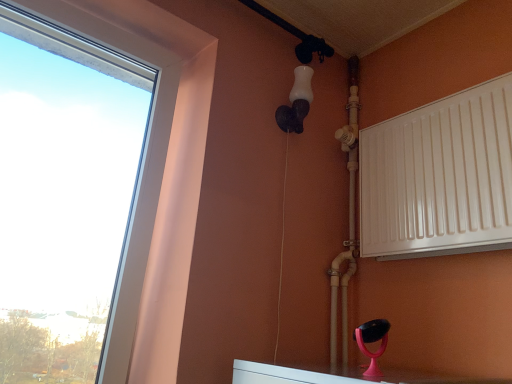
This screenshot has height=384, width=512. I want to click on white matte radiator at right, so click(439, 177).

Describe the element at coordinates (349, 219) in the screenshot. I see `white glossy pipe at upper right` at that location.

Find the location of a particular element. The image size is (512, 384). white plastic window at left is located at coordinates (146, 184).

Is white plastic window at left smaller than white matte light fixture at upper center?

No.

Does white plastic window at left have a lesser width compared to white matte light fixture at upper center?

Incorrect, the width of white plastic window at left is not less than that of white matte light fixture at upper center.

From the image's perspective, is white plastic window at left on top of white matte light fixture at upper center?

No, from the image's perspective, white plastic window at left is not on top of white matte light fixture at upper center.

Is white glossy pipe at upper right smaller than white matte light fixture at upper center?

No, white glossy pipe at upper right is not smaller than white matte light fixture at upper center.

Is white glossy pipe at upper right not near white matte light fixture at upper center?

No, white glossy pipe at upper right is not far from white matte light fixture at upper center.

Does white glossy pipe at upper right turn towards white matte light fixture at upper center?

Yes.

Is white matte light fixture at upper center surrounded by white glossy pipe at upper right?

Definitely not — white matte light fixture at upper center is not inside white glossy pipe at upper right.

This screenshot has height=384, width=512. What are the coordinates of `pipe on the right side of white plastic window at left` in the screenshot? It's located at (349, 219).

Which is more to the right, white plastic window at left or white glossy pipe at upper right?

From the viewer's perspective, white glossy pipe at upper right appears more on the right side.

Is white plastic window at left inside the boundaries of white glossy pipe at upper right, or outside?

white plastic window at left is not inside white glossy pipe at upper right, it's outside.

Is white glossy pipe at upper right in front of or behind white matte radiator at right in the image?

Clearly, white glossy pipe at upper right is behind white matte radiator at right.

Between white glossy pipe at upper right and white matte radiator at right, which one has less height?

With less height is white matte radiator at right.

Does white glossy pipe at upper right have a smaller size compared to white matte radiator at right?

Correct, white glossy pipe at upper right occupies less space than white matte radiator at right.

Considering the relative sizes of white glossy pipe at upper right and white matte radiator at right in the image provided, is white glossy pipe at upper right wider than white matte radiator at right?

Yes, white glossy pipe at upper right is wider than white matte radiator at right.

From a real-world perspective, who is located lower, white glossy pipe at upper right or white plastic window at left?

Answer: From a 3D spatial view, white plastic window at left is below.

Would you say white glossy pipe at upper right is inside or outside white plastic window at left?

white glossy pipe at upper right exists outside the volume of white plastic window at left.

Can you confirm if white glossy pipe at upper right is smaller than white plastic window at left?

Yes, white glossy pipe at upper right is smaller than white plastic window at left.

Which is farther from the camera, (397, 128) or (180, 60)?

Point (180, 60)

Which object is further away from the camera, white matte radiator at right or white plastic window at left?

white matte radiator at right is behind.

From a real-world perspective, is white matte radiator at right positioned above or below white plastic window at left?

white matte radiator at right is situated higher than white plastic window at left in the real world.

Are white matte radiator at right and white plastic window at left located far from each other?

white matte radiator at right is near white plastic window at left, not far away.

Is white plastic window at left not within white matte radiator at right?

Yes, white plastic window at left is not within white matte radiator at right.

Measure the distance between white plastic window at left and white matte radiator at right.

They are 31.21 inches apart.

Looking at this image, visually, is white plastic window at left positioned to the left or to the right of white matte radiator at right?

white plastic window at left is positioned on white matte radiator at right's left side.

From the image's perspective, is white plastic window at left on top of white matte radiator at right?

Correct, white plastic window at left appears higher than white matte radiator at right in the image.

At what (x,y) coordinates should I click in order to perform the action: click on window below the white matte light fixture at upper center (from the image's perspective). Please return your answer as a coordinate pair (x, y). The width and height of the screenshot is (512, 384). Looking at the image, I should click on (146, 184).

Find the location of `pipe below the white matte light fixture at upper center (from a real-world perspective)`. pipe below the white matte light fixture at upper center (from a real-world perspective) is located at coordinates (349, 219).

Considering their positions, is white matte light fixture at upper center positioned further to white matte radiator at right than white plastic window at left?

Among the two, white plastic window at left is located further to white matte radiator at right.

When comparing their distances from white glossy pipe at upper right, does white plastic window at left or white matte light fixture at upper center seem closer?

Based on the image, white matte light fixture at upper center appears to be nearer to white glossy pipe at upper right.

Looking at the image, which one is located further to white matte light fixture at upper center, white plastic window at left or white glossy pipe at upper right?

white plastic window at left is further to white matte light fixture at upper center.

Looking at the image, which one is located further to white matte radiator at right, white plastic window at left or white glossy pipe at upper right?

white plastic window at left is positioned further to the anchor white matte radiator at right.

Which object lies further to the anchor point white matte light fixture at upper center, white matte radiator at right or white plastic window at left?

white plastic window at left.

Estimate the real-world distances between objects in this image. Which object is further from white plastic window at left, white glossy pipe at upper right or white matte light fixture at upper center?

Based on the image, white glossy pipe at upper right appears to be further to white plastic window at left.

Based on their spatial positions, is white matte radiator at right or white glossy pipe at upper right further from white matte light fixture at upper center?

white matte radiator at right lies further to white matte light fixture at upper center than the other object.

Which object lies nearer to the anchor point white plastic window at left, white glossy pipe at upper right or white matte radiator at right?

white glossy pipe at upper right is closer to white plastic window at left.

The height and width of the screenshot is (384, 512). I want to click on pipe between white plastic window at left and white matte light fixture at upper center along the z-axis, so click(x=349, y=219).

Where is `pipe located between white matte light fixture at upper center and white matte radiator at right in the left-right direction`? The width and height of the screenshot is (512, 384). pipe located between white matte light fixture at upper center and white matte radiator at right in the left-right direction is located at coordinates (349, 219).

I want to click on light fixture between white plastic window at left and white matte radiator at right in the horizontal direction, so click(296, 102).

This screenshot has width=512, height=384. Find the location of `pipe between white plastic window at left and white matte radiator at right`. pipe between white plastic window at left and white matte radiator at right is located at coordinates (349, 219).